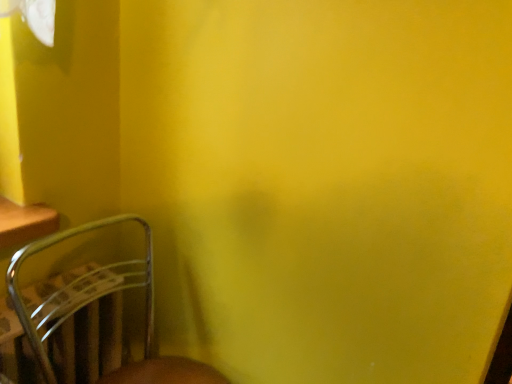
Identify the location of metallic brown chair at lower left. (56, 243).

Image resolution: width=512 pixels, height=384 pixels. What do you see at coordinates (56, 243) in the screenshot?
I see `metallic brown chair at lower left` at bounding box center [56, 243].

The height and width of the screenshot is (384, 512). Find the location of `metallic brown chair at lower left`. metallic brown chair at lower left is located at coordinates tap(56, 243).